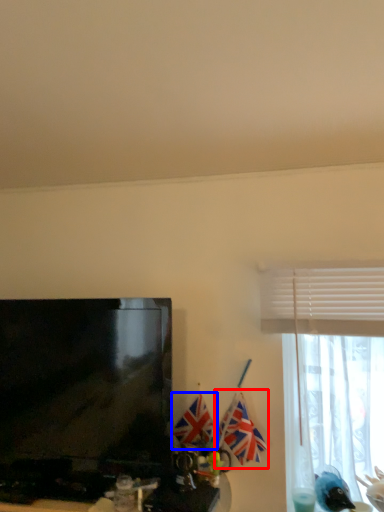
Question: Which of the following is the farthest to the observer, flag (highlighted by a red box) or flag (highlighted by a blue box)?

Choices:
 (A) flag
 (B) flag

Answer: (B)